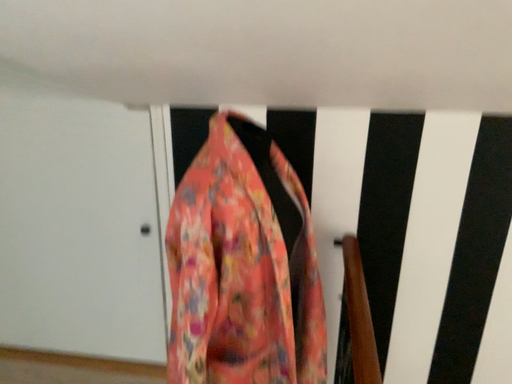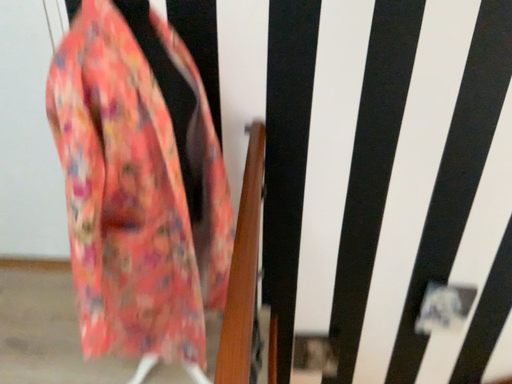
Question: How did the camera likely rotate when shooting the video?

Choices:
 (A) rotated upward
 (B) rotated downward

Answer: (B)